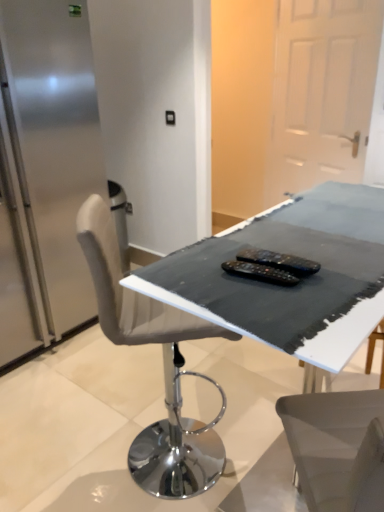
Where is `vacant space behind black plastic remote controls at center, arranged as the 2th equipment when viewed from the top`? The width and height of the screenshot is (384, 512). vacant space behind black plastic remote controls at center, arranged as the 2th equipment when viewed from the top is located at coordinates (248, 245).